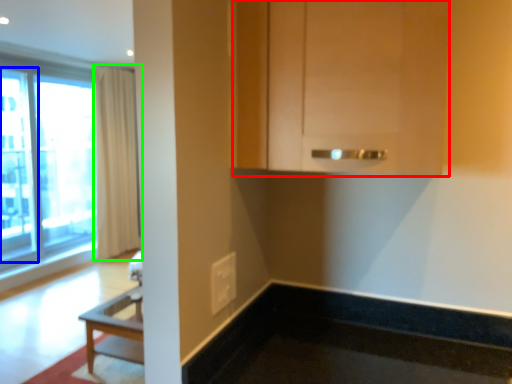
Question: Which object is the farthest from cabinetry (highlighted by a red box)? Choose among these: screen door (highlighted by a blue box) or curtain (highlighted by a green box).

Choices:
 (A) screen door
 (B) curtain

Answer: (B)